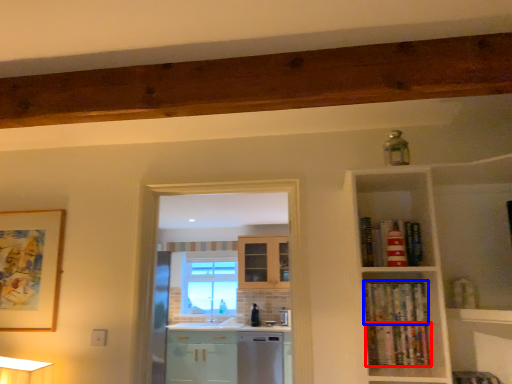
Question: Which point is closer to the camera, book (highlighted by a red box) or book (highlighted by a blue box)?

Choices:
 (A) book
 (B) book

Answer: (A)